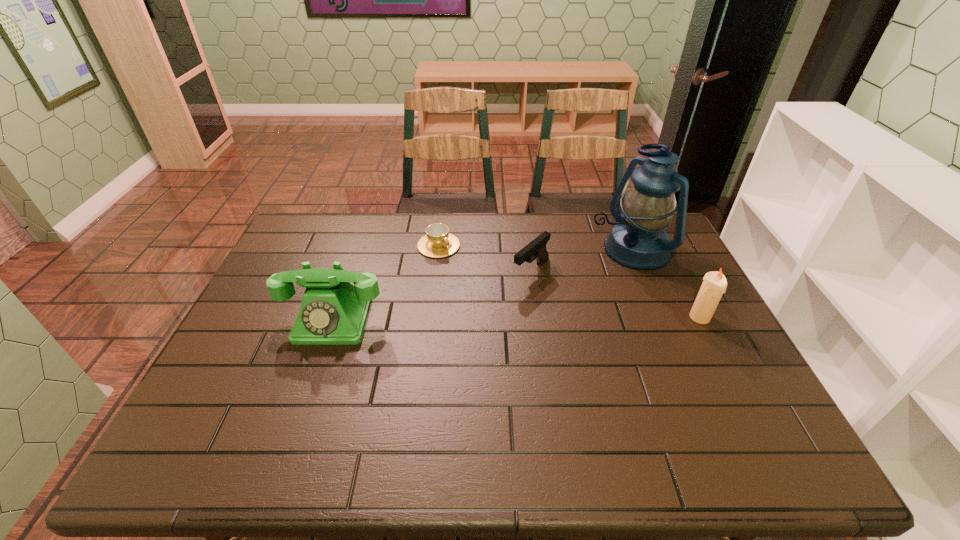
Locate an element on the screen. The width and height of the screenshot is (960, 540). object present at the left edge is located at coordinates (333, 311).

The image size is (960, 540). I want to click on candle at the right edge, so click(714, 284).

The height and width of the screenshot is (540, 960). Identify the location of lantern that is at the right edge. (638, 240).

The image size is (960, 540). What are the coordinates of `object that is at the far right corner` in the screenshot? It's located at (638, 240).

What are the coordinates of `blank space at the far edge of the desktop` in the screenshot? It's located at (594, 252).

This screenshot has height=540, width=960. Find the location of `free location at the near edge`. free location at the near edge is located at coordinates (498, 396).

This screenshot has width=960, height=540. In order to click on blank space at the left edge in this screenshot , I will do click(x=277, y=333).

In the image, there is a desktop. Where is `free space at the right edge`? This screenshot has height=540, width=960. free space at the right edge is located at coordinates (755, 389).

Locate an element on the screen. free space at the near left corner is located at coordinates [202, 418].

In order to click on free point between the candle and the telephone in this screenshot , I will do pos(516,318).